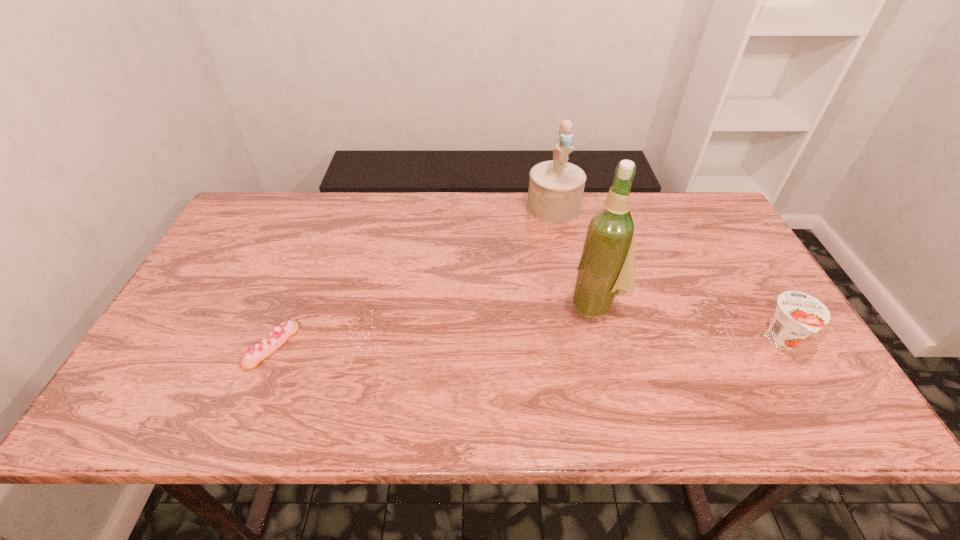
Find the location of a particular element. The width and height of the screenshot is (960, 540). free spot located on the front-facing side of the tallest object is located at coordinates (534, 341).

The width and height of the screenshot is (960, 540). What are the coordinates of `free spot located 0.200m on the front-facing side of the tallest object` in the screenshot? It's located at (514, 353).

Find the location of `vacant point located 0.210m at the beak of the second tallest object`. vacant point located 0.210m at the beak of the second tallest object is located at coordinates (571, 271).

Locate an element on the screen. This screenshot has height=540, width=960. free spot located 0.330m at the beak of the second tallest object is located at coordinates (580, 303).

I want to click on vacant region located 0.110m at the beak of the second tallest object, so click(x=564, y=247).

In order to click on object present at the far edge in this screenshot , I will do click(x=556, y=187).

Locate an element on the screen. The image size is (960, 540). eclair positioned at the near edge is located at coordinates (271, 343).

The image size is (960, 540). In order to click on yogurt that is at the near edge in this screenshot , I will do `click(797, 314)`.

Locate an element on the screen. object that is at the right edge is located at coordinates (797, 314).

At what (x,y) coordinates should I click in order to perform the action: click on object that is at the near right corner. Please return your answer as a coordinate pair (x, y). The height and width of the screenshot is (540, 960). Looking at the image, I should click on pos(797,314).